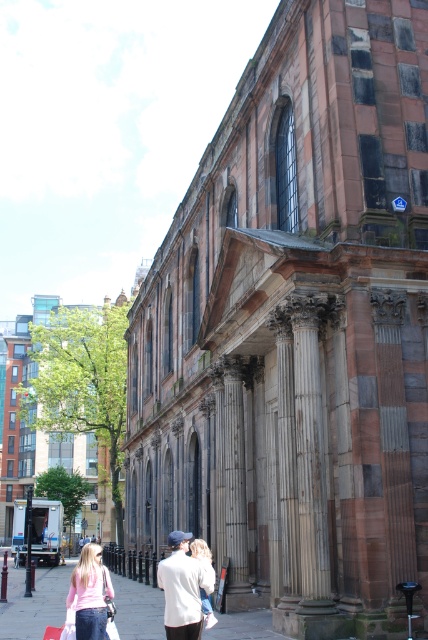
Does matte blue baby carriage at lower left have a greater width compared to light beige sweater at center?

Correct, the width of matte blue baby carriage at lower left exceeds that of light beige sweater at center.

Is matte blue baby carriage at lower left thinner than light beige sweater at center?

No.

Where is `matte blue baby carriage at lower left`? matte blue baby carriage at lower left is located at coordinates point(47,531).

Where is `matte blue baby carriage at lower left`? matte blue baby carriage at lower left is located at coordinates (47, 531).

Consider the image. Is smooth concrete pavement at lower center positioned before pink matte shirt at lower left?

No, it is behind pink matte shirt at lower left.

Which of these two, smooth concrete pavement at lower center or pink matte shirt at lower left, stands shorter?

pink matte shirt at lower left

This screenshot has height=640, width=428. In order to click on smooth concrete pavement at lower center in this screenshot , I will do `click(33, 602)`.

Where is `smooth concrete pavement at lower center`? The image size is (428, 640). smooth concrete pavement at lower center is located at coordinates (33, 602).

Who is positioned more to the right, pink matte shirt at lower left or matte blue baby carriage at lower left?

pink matte shirt at lower left

Describe the element at coordinates (89, 593) in the screenshot. I see `pink matte shirt at lower left` at that location.

At what (x,y) coordinates should I click in order to perform the action: click on pink matte shirt at lower left. Please return your answer as a coordinate pair (x, y). Image resolution: width=428 pixels, height=640 pixels. Looking at the image, I should click on (89, 593).